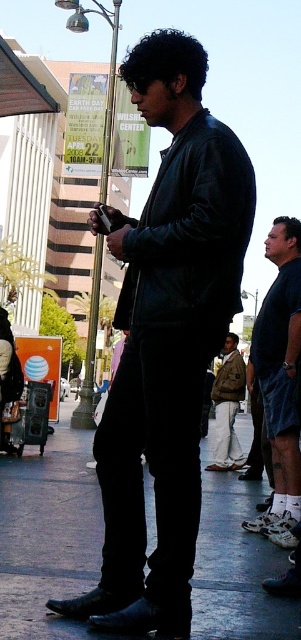
Who is more forward, (12, 621) or (276, 464)?

Point (12, 621) is in front.

Is black leather shoes at lower center wider than dark blue jeans at lower right?

Indeed, black leather shoes at lower center has a greater width compared to dark blue jeans at lower right.

Between point (199, 609) and point (295, 298), which one is positioned behind?

Positioned behind is point (295, 298).

You are a GUI agent. You are given a task and a screenshot of the screen. Output one action in this format:
    pyautogui.click(x=<x>, y=<y>)
    Task: Click on the black leather shoes at lower center
    This screenshot has height=640, width=301.
    Given the screenshot: What is the action you would take?
    pyautogui.click(x=47, y=534)

Does matte black jacket at center appear on the right side of metallic silver awning at upper left?

Yes, matte black jacket at center is to the right of metallic silver awning at upper left.

Does point (183, 579) come in front of point (42, 93)?

Yes, point (183, 579) is in front of point (42, 93).

Locate an element on the screen. matte black jacket at center is located at coordinates (165, 339).

Can you confirm if matte black jacket at center is positioned to the right of black leather shoes at lower center?

Correct, you'll find matte black jacket at center to the right of black leather shoes at lower center.

Who is positioned more to the left, matte black jacket at center or black leather shoes at lower center?

Positioned to the left is black leather shoes at lower center.

Locate an element on the screen. The width and height of the screenshot is (301, 640). matte black jacket at center is located at coordinates (165, 339).